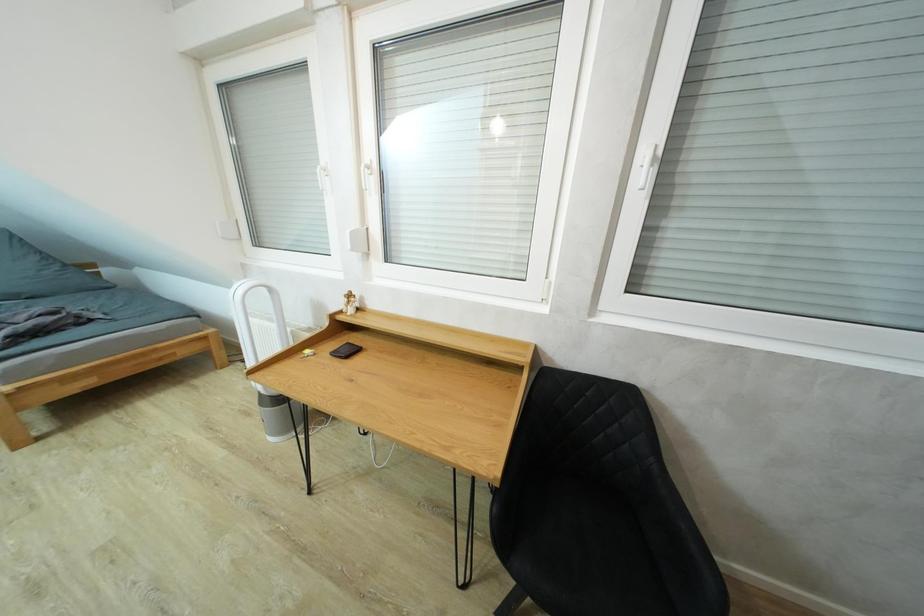
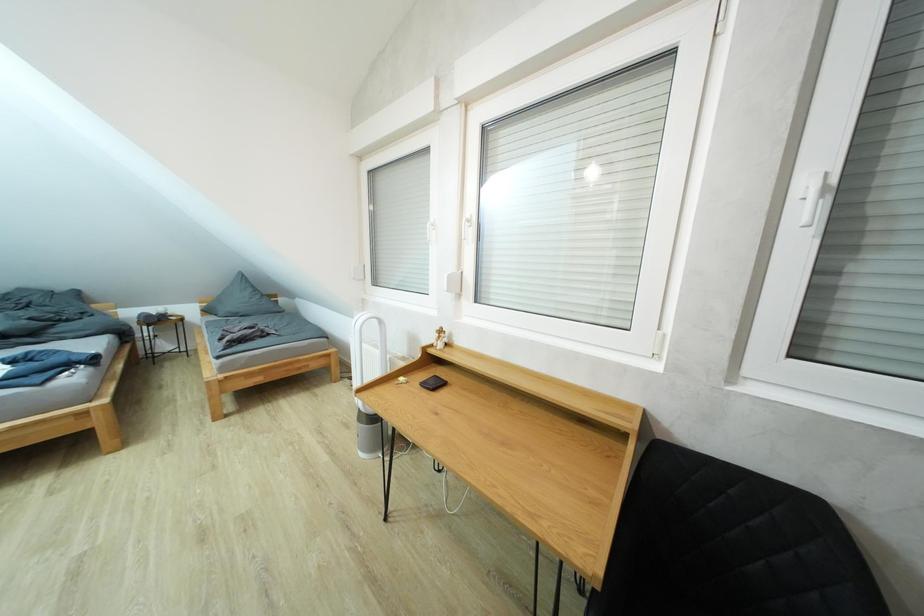
Which direction would the cameraman need to move to produce the second image?

The cameraman moved toward left, backward.